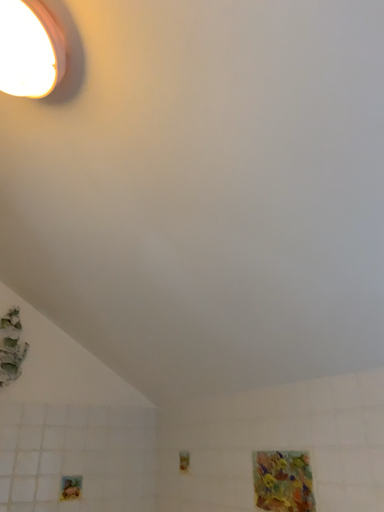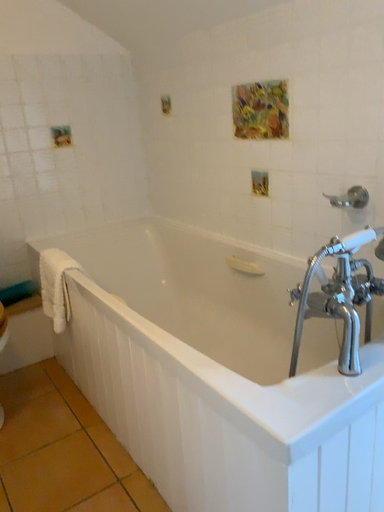
Question: Which way did the camera rotate in the video?

Choices:
 (A) rotated upward
 (B) rotated downward

Answer: (B)